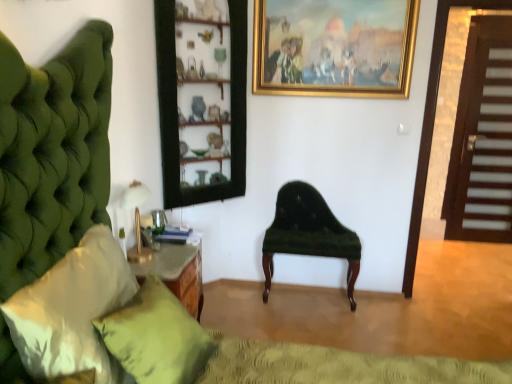
At what (x,y) coordinates should I click in order to perform the action: click on vacant region under velvet green bench at center (from a real-world perspective). Please return your answer as a coordinate pair (x, y). This screenshot has height=384, width=512. Looking at the image, I should click on tap(308, 302).